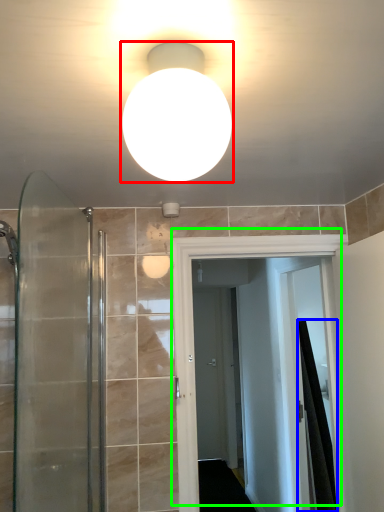
Question: Estimate the real-world distances between objects in this image. Which object is closer to light fixture (highlighted by a red box), shower curtain (highlighted by a blue box) or door (highlighted by a green box)?

Choices:
 (A) shower curtain
 (B) door

Answer: (B)